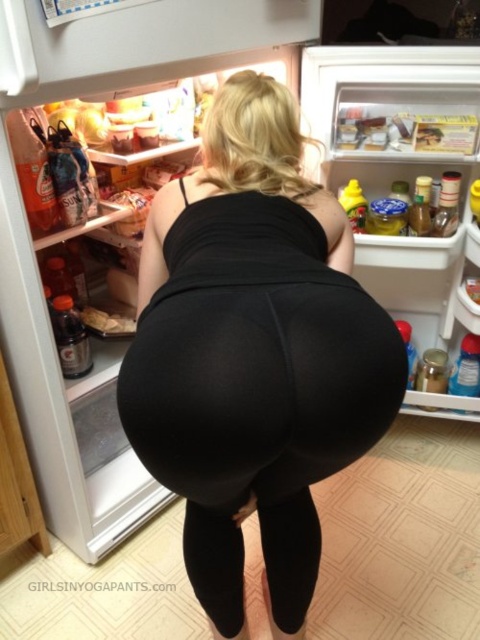
Is black matte leggings at center to the left of black leggings at lower center from the viewer's perspective?

Indeed, black matte leggings at center is positioned on the left side of black leggings at lower center.

Which is behind, point (334, 420) or point (290, 557)?

Positioned behind is point (290, 557).

You are a GUI agent. You are given a task and a screenshot of the screen. Output one action in this format:
    pyautogui.click(x=<x>, y=<y>)
    Task: Click on the black matte leggings at center
    
    Given the screenshot: What is the action you would take?
    pyautogui.click(x=253, y=355)

Locate an element on the screen. black matte leggings at center is located at coordinates (253, 355).